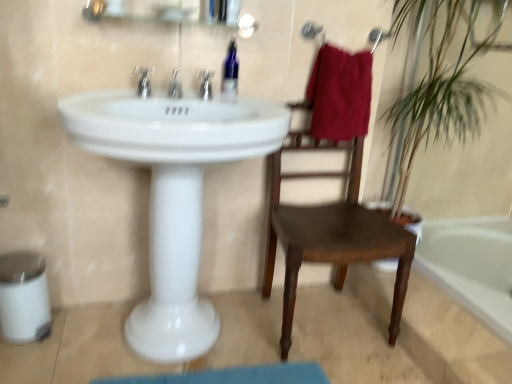
Locate an element on the screen. vacant space situated on the left part of silver metallic faucet at upper center, acting as the 3th tap starting from the right is located at coordinates (103, 96).